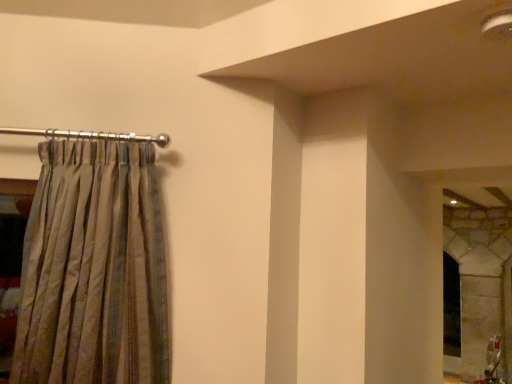
Image resolution: width=512 pixels, height=384 pixels. Describe the element at coordinates (94, 265) in the screenshot. I see `textured beige curtain at left` at that location.

What is the approximate width of textured beige curtain at left?

The width of textured beige curtain at left is 15.19 inches.

Where is `textured beige curtain at left`? This screenshot has width=512, height=384. textured beige curtain at left is located at coordinates (94, 265).

Image resolution: width=512 pixels, height=384 pixels. What are the coordinates of `textured beige curtain at left` in the screenshot? It's located at [94, 265].